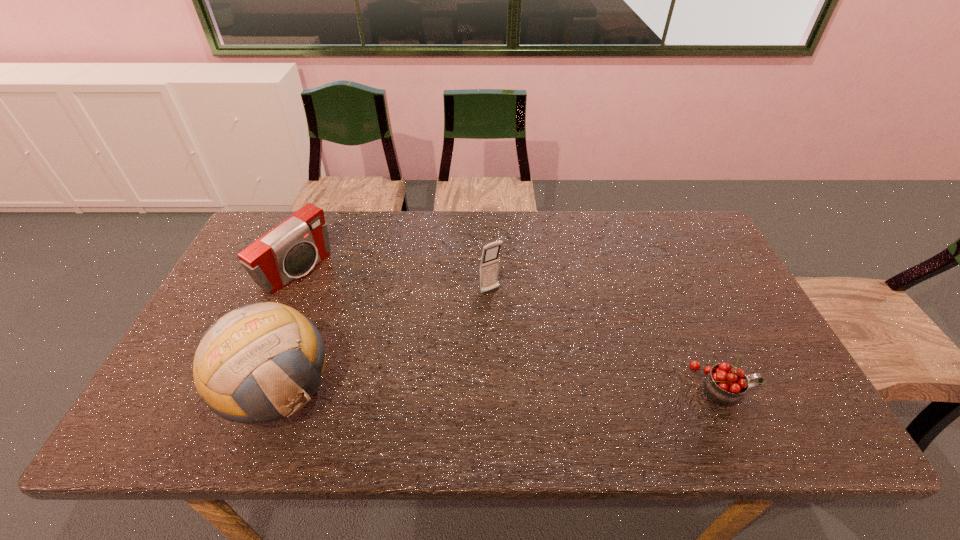
Where is `free space that is in between the third object from left to right and the shortest object`? The width and height of the screenshot is (960, 540). free space that is in between the third object from left to right and the shortest object is located at coordinates pyautogui.click(x=606, y=339).

The width and height of the screenshot is (960, 540). Identify the location of free space between the camera and the pot filled with cherries. (509, 328).

Find the location of a particular element. Image resolution: width=960 pixels, height=540 pixels. vacant area that lies between the shortest object and the camera is located at coordinates (509, 328).

At what (x,y) coordinates should I click in order to perform the action: click on vacant point located between the tallest object and the third object from left to right. Please return your answer as a coordinate pair (x, y). This screenshot has width=960, height=540. Looking at the image, I should click on (384, 341).

Select which object appears as the second closest to the tallest object. Please provide its 2D coordinates. Your answer should be formatted as a tuple, i.e. [(x, y)], where the tuple contains the x and y coordinates of a point satisfying the conditions above.

[(489, 261)]

In order to click on object that is the third closest to the cellular telephone in this screenshot , I will do `click(725, 384)`.

Locate an element on the screen. free location that satisfies the following two spatial constraints: 1. on the back side of the volleyball; 2. on the handle side of the rightmost object is located at coordinates (280, 386).

You are a GUI agent. You are given a task and a screenshot of the screen. Output one action in this format:
    pyautogui.click(x=<x>, y=<y>)
    Task: Click on the vacant area in the image that satisfies the following two spatial constraints: 1. on the front side of the second object from right to left; 2. on the handle side of the rightmost object
    Image resolution: width=960 pixels, height=540 pixels.
    Given the screenshot: What is the action you would take?
    pyautogui.click(x=492, y=386)